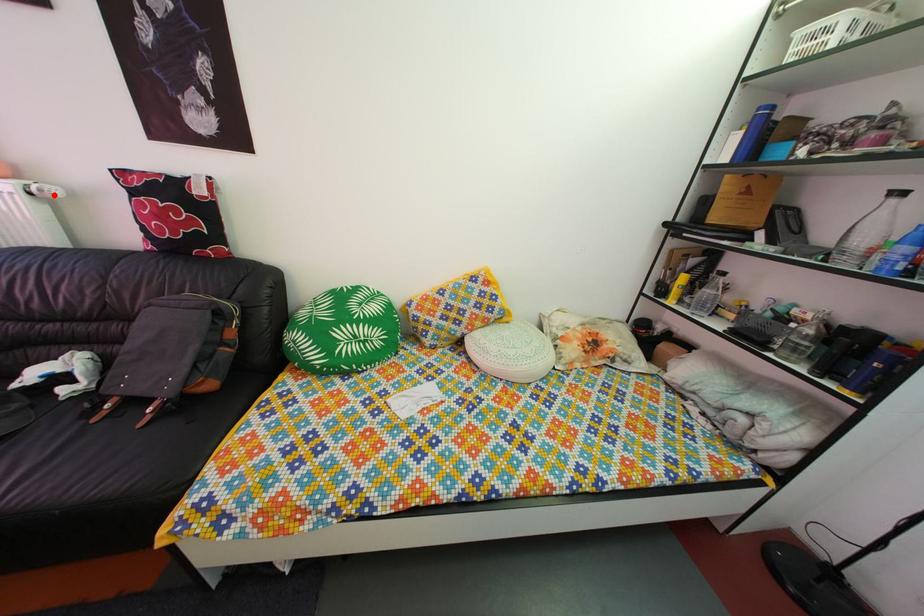
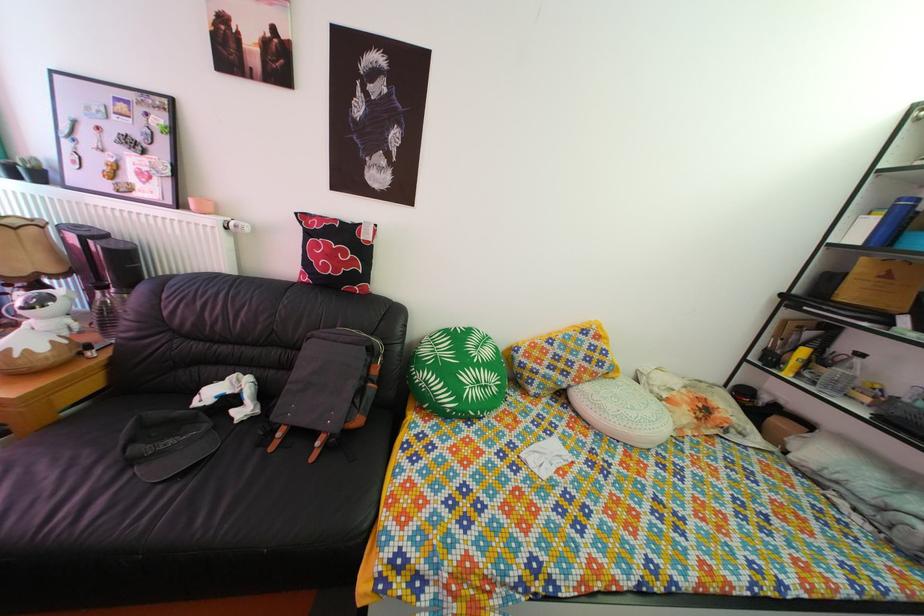
Find the pixel in the second image that matches the highlighted location in the first image.

(249, 232)